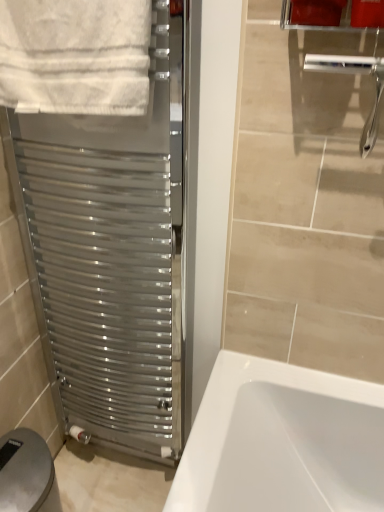
Question: From a real-world perspective, is matte plastic toilet paper holder at lower left physically below satin metallic towel warmer at left?

Choices:
 (A) no
 (B) yes

Answer: (B)

Question: Considering the relative sizes of matte plastic toilet paper holder at lower left and satin metallic towel warmer at left in the image provided, is matte plastic toilet paper holder at lower left taller than satin metallic towel warmer at left?

Choices:
 (A) no
 (B) yes

Answer: (A)

Question: Does matte plastic toilet paper holder at lower left have a lesser height compared to satin metallic towel warmer at left?

Choices:
 (A) yes
 (B) no

Answer: (A)

Question: Would you say matte plastic toilet paper holder at lower left contains satin metallic towel warmer at left?

Choices:
 (A) yes
 (B) no

Answer: (B)

Question: Is matte plastic toilet paper holder at lower left positioned before satin metallic towel warmer at left?

Choices:
 (A) yes
 (B) no

Answer: (B)

Question: Choose the correct answer: Is matte plastic toilet paper holder at lower left inside white cotton towel at upper left or outside it?

Choices:
 (A) inside
 (B) outside

Answer: (B)

Question: Does point (21, 506) appear closer or farther from the camera than point (54, 94)?

Choices:
 (A) farther
 (B) closer

Answer: (A)

Question: From a real-world perspective, is matte plastic toilet paper holder at lower left physically located above or below white cotton towel at upper left?

Choices:
 (A) below
 (B) above

Answer: (A)

Question: Is matte plastic toilet paper holder at lower left wider or thinner than white cotton towel at upper left?

Choices:
 (A) wide
 (B) thin

Answer: (A)

Question: In the image, is white cotton towel at upper left on the left side or the right side of satin metallic towel warmer at left?

Choices:
 (A) left
 (B) right

Answer: (B)

Question: From their relative heights in the image, would you say white cotton towel at upper left is taller or shorter than satin metallic towel warmer at left?

Choices:
 (A) tall
 (B) short

Answer: (B)

Question: Is white cotton towel at upper left bigger or smaller than satin metallic towel warmer at left?

Choices:
 (A) small
 (B) big

Answer: (A)

Question: From a real-world perspective, is white cotton towel at upper left above or below satin metallic towel warmer at left?

Choices:
 (A) above
 (B) below

Answer: (A)

Question: Is matte plastic toilet paper holder at lower left spatially inside satin metallic towel warmer at left, or outside of it?

Choices:
 (A) outside
 (B) inside

Answer: (A)

Question: Considering their positions, is matte plastic toilet paper holder at lower left located in front of or behind satin metallic towel warmer at left?

Choices:
 (A) behind
 (B) front

Answer: (A)